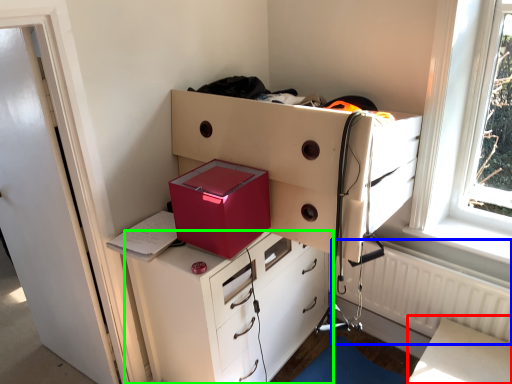
Question: Which object is the farthest from table (highlighted by a red box)? Choose among these: radiator (highlighted by a blue box) or chest of drawers (highlighted by a green box).

Choices:
 (A) radiator
 (B) chest of drawers

Answer: (B)